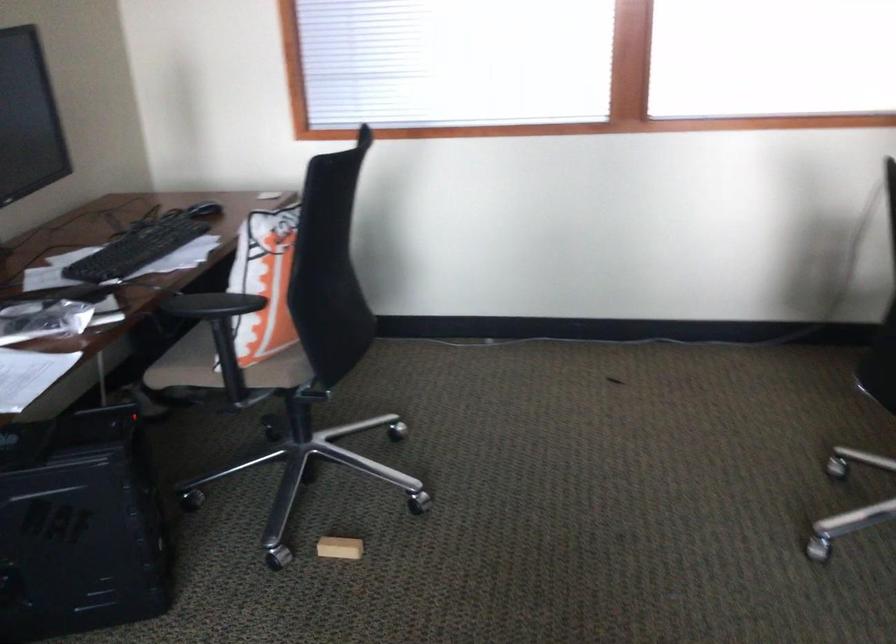
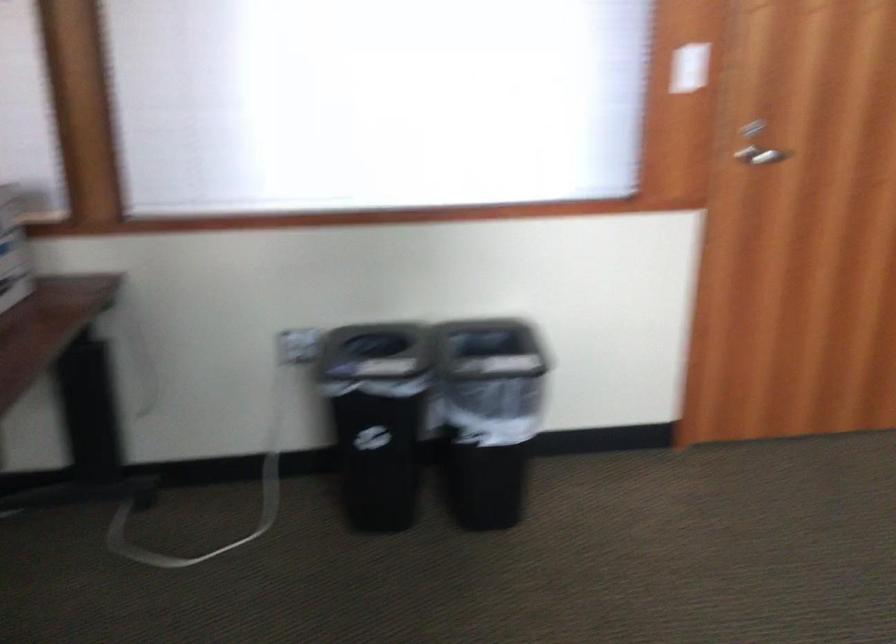
Question: Which direction would the cameraman need to move to produce the second image? Reply with the corresponding letter.

Choices:
 (A) Left
 (B) Right
 (C) Forward
 (D) Backward

Answer: (B)